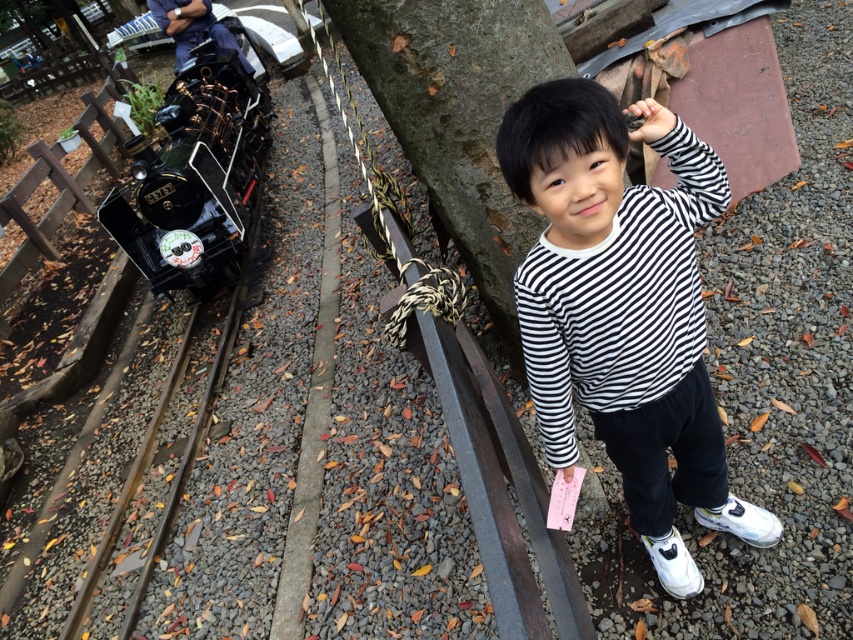
Does black striped shirt at center have a larger size compared to brown wooden train track at left?

No, black striped shirt at center is not bigger than brown wooden train track at left.

Between point (672, 349) and point (146, 465), which one is positioned behind?

Positioned behind is point (146, 465).

You are a GUI agent. You are given a task and a screenshot of the screen. Output one action in this format:
    pyautogui.click(x=<x>, y=<y>)
    Task: Click on the black striped shirt at center
    
    Given the screenshot: What is the action you would take?
    pyautogui.click(x=624, y=308)

What do you see at coordinates (624, 308) in the screenshot?
I see `black striped shirt at center` at bounding box center [624, 308].

Does black striped shirt at center have a lesser height compared to shiny black locomotive at left?

Indeed, black striped shirt at center has a lesser height compared to shiny black locomotive at left.

Which is behind, point (675, 170) or point (166, 108)?

Point (166, 108)

I want to click on black striped shirt at center, so click(624, 308).

Who is more distant from viewer, (213, 163) or (91, 586)?

The point (213, 163) is behind.

Find the location of a particular element. This screenshot has height=640, width=853. shiny black locomotive at left is located at coordinates (194, 177).

Does point (149, 227) come behind point (172, 387)?

Yes, it is behind point (172, 387).

Identify the location of shiny black locomotive at left. This screenshot has height=640, width=853. (194, 177).